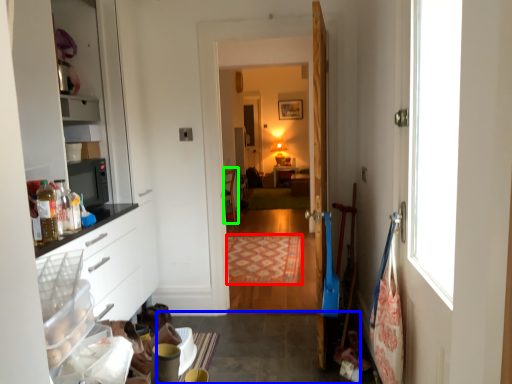
Question: Considering the real-world distances, which object is closest to mat (highlighted by a red box)? concrete (highlighted by a blue box) or chair (highlighted by a green box).

Choices:
 (A) concrete
 (B) chair

Answer: (A)